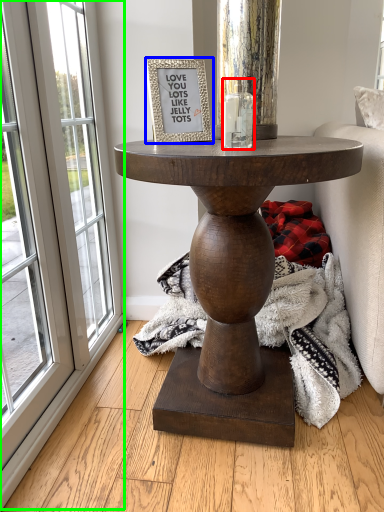
Question: Which object is positioned closest to candle holder (highlighted by a red box)? Select from picture frame (highlighted by a blue box) and screen door (highlighted by a green box).

Choices:
 (A) picture frame
 (B) screen door

Answer: (A)